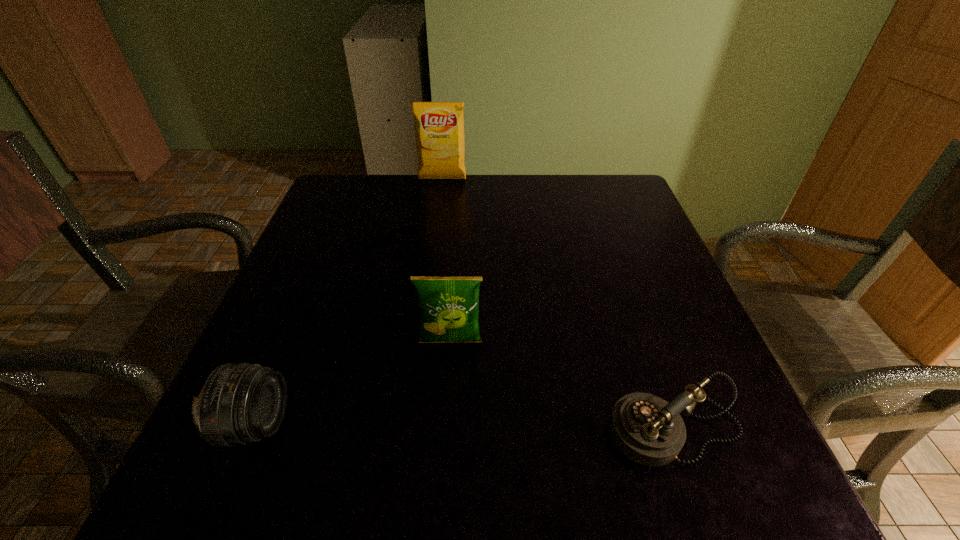
This screenshot has height=540, width=960. I want to click on vacant area that lies between the taller crisp (potato chip) and the telephoto lens, so click(x=348, y=302).

Locate an element on the screen. free space between the telephoto lens and the rightmost object is located at coordinates (466, 427).

What are the coordinates of `free space between the rightmost object and the nearer crisp (potato chip)` in the screenshot? It's located at (563, 386).

The width and height of the screenshot is (960, 540). In order to click on free spot between the telephone and the telephoto lens in this screenshot , I will do `click(466, 427)`.

Image resolution: width=960 pixels, height=540 pixels. I want to click on unoccupied position between the taller crisp (potato chip) and the third shortest object, so click(x=446, y=261).

Identify the location of the third closest object relative to the tallest object. (647, 429).

The width and height of the screenshot is (960, 540). What are the coordinates of `object that is the nearest to the leftmost object` in the screenshot? It's located at (449, 306).

Locate an element on the screen. The height and width of the screenshot is (540, 960). vacant area that satisfies the following two spatial constraints: 1. on the front-facing side of the telephone; 2. on the left side of the shorter crisp (potato chip) is located at coordinates (445, 429).

Image resolution: width=960 pixels, height=540 pixels. I want to click on free space that satisfies the following two spatial constraints: 1. on the front-facing side of the shorter crisp (potato chip); 2. at the front element of the telephoto lens, so click(x=445, y=424).

Where is `vacant region that satisfies the following two spatial constraints: 1. on the front of the taller crisp (potato chip) with the logo; 2. at the front element of the telephoto lens`? vacant region that satisfies the following two spatial constraints: 1. on the front of the taller crisp (potato chip) with the logo; 2. at the front element of the telephoto lens is located at coordinates [x=412, y=424].